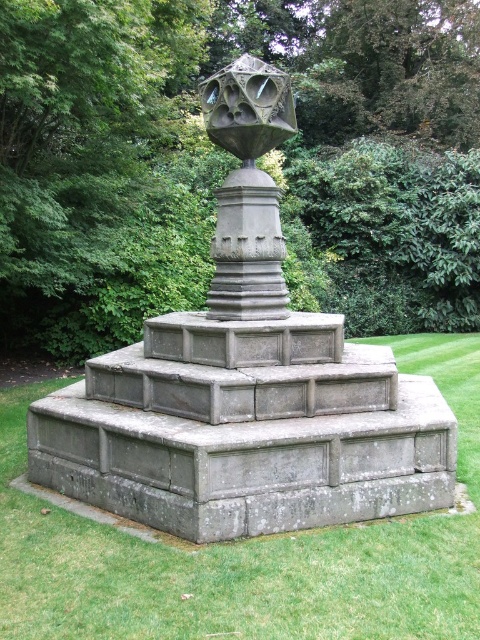
Can you confirm if green grass at center is positioned to the left of polished stone sphere at center?

No, green grass at center is not to the left of polished stone sphere at center.

Which is below, green grass at center or polished stone sphere at center?

green grass at center

The width and height of the screenshot is (480, 640). In order to click on green grass at center in this screenshot , I will do `click(249, 554)`.

I want to click on green grass at center, so click(x=249, y=554).

Is point (265, 512) closer to viewer compared to point (14, 573)?

That is False.

Is gray stone sculpture at center taller than green grass at center?

Yes.

What do you see at coordinates (245, 384) in the screenshot?
I see `gray stone sculpture at center` at bounding box center [245, 384].

Locate an element on the screen. The width and height of the screenshot is (480, 640). gray stone sculpture at center is located at coordinates (245, 384).

Does gray stone sculpture at center have a lesser height compared to polished stone sphere at center?

Correct, gray stone sculpture at center is not as tall as polished stone sphere at center.

In order to click on gray stone sculpture at center in this screenshot , I will do `click(245, 384)`.

I want to click on gray stone sculpture at center, so click(245, 384).